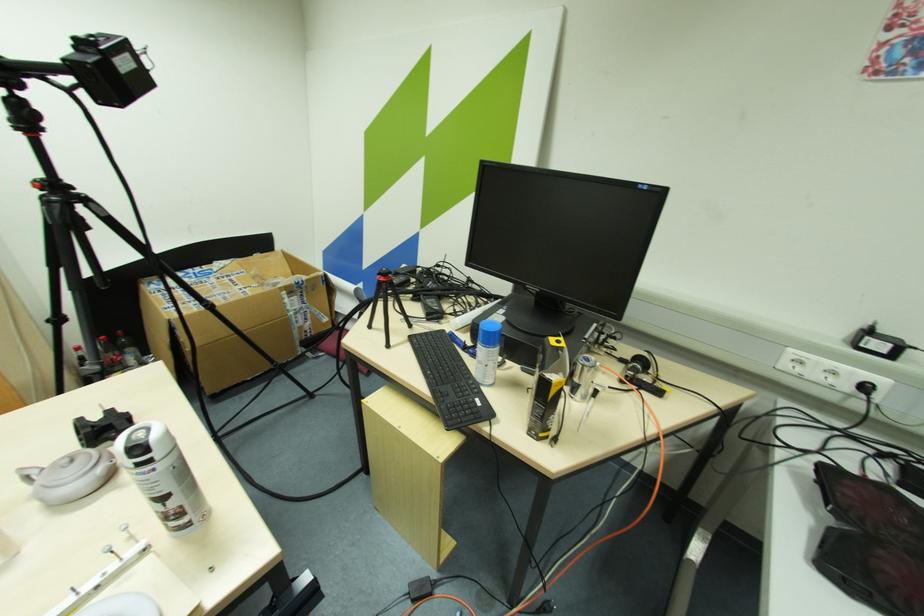
Find where to lift the black computer keyboard. Please return your answer as a coordinate pair (x, y).

(450, 381)